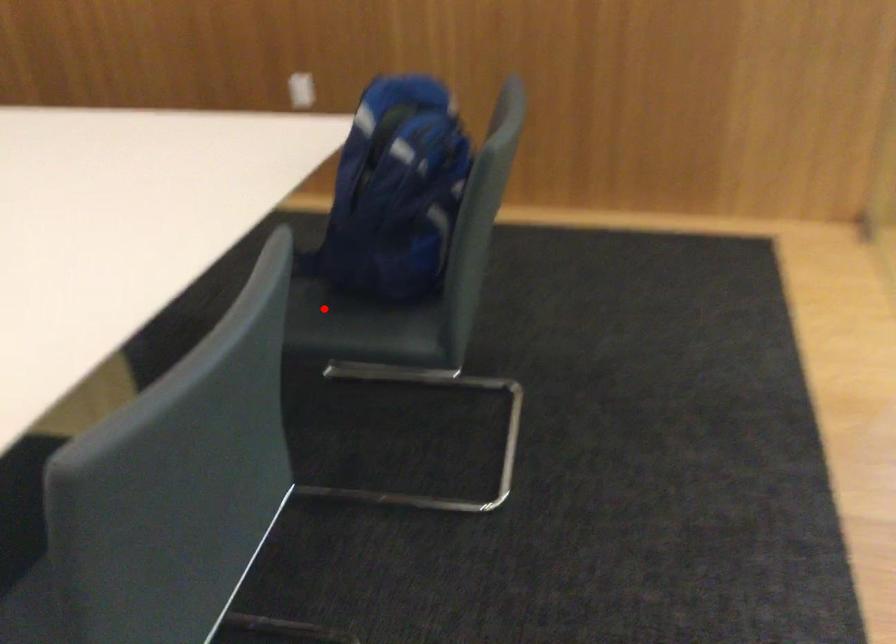
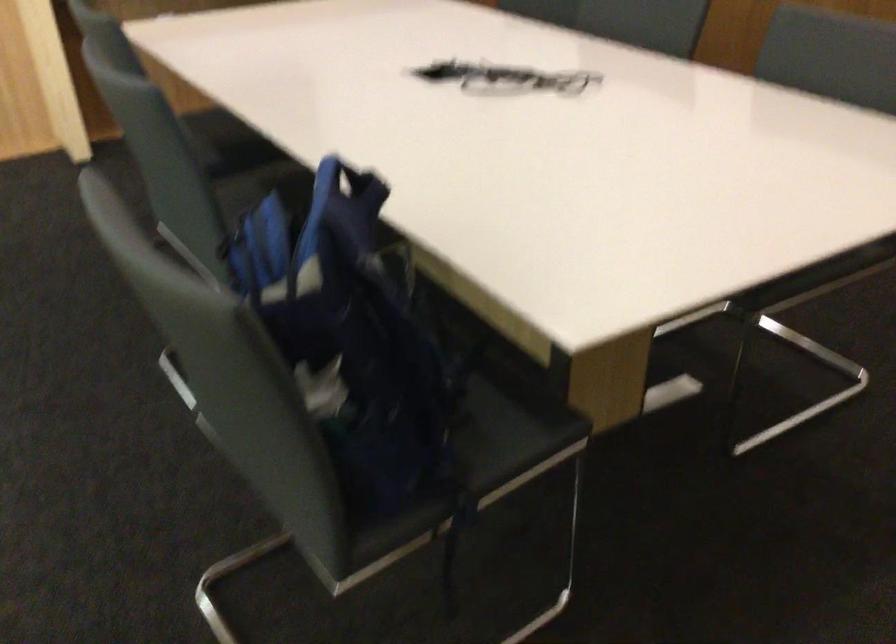
Question: I am providing you with two images of the same scene from different viewpoints. A red point is marked on the first image. Is the red point's position out of view in image 2?

Choices:
 (A) Yes
 (B) No

Answer: (A)